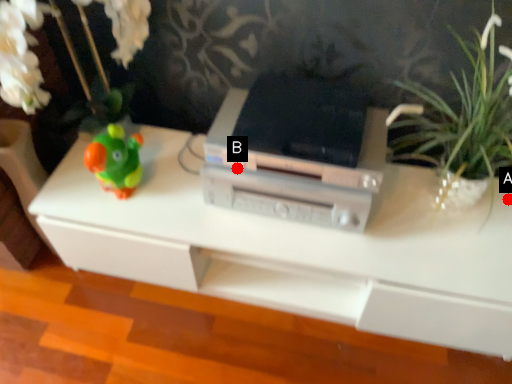
Question: Two points are circled on the image, labeled by A and B beside each circle. Which point appears closest to the camera in this image?

Choices:
 (A) A is closer
 (B) B is closer

Answer: (B)